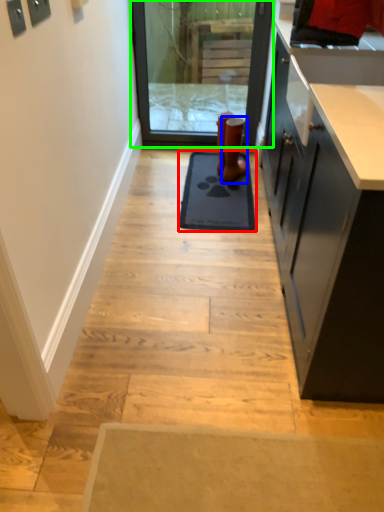
Question: Based on their relative distances, which object is farther from mat (highlighted by a red box)? Choose from footwear (highlighted by a blue box) and screen door (highlighted by a green box).

Choices:
 (A) footwear
 (B) screen door

Answer: (B)